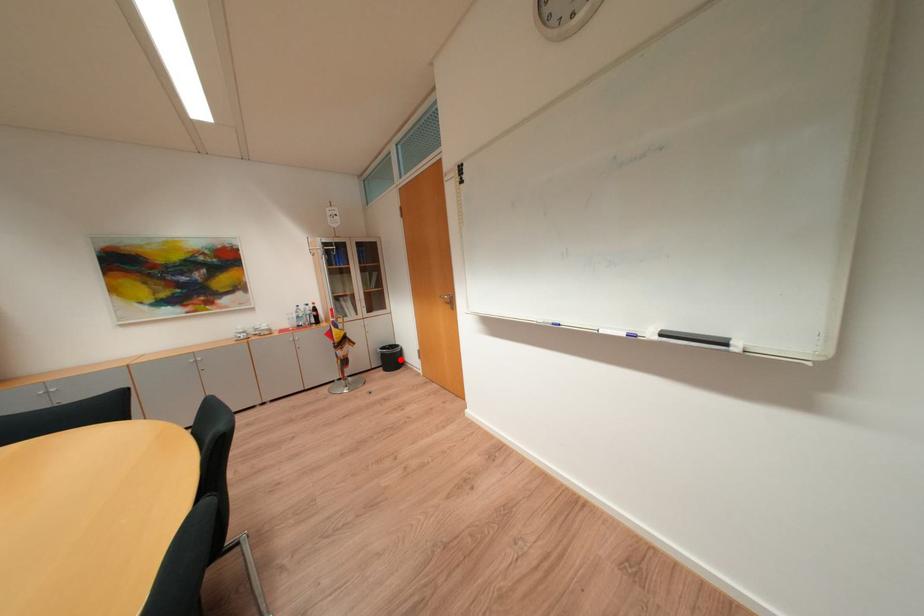
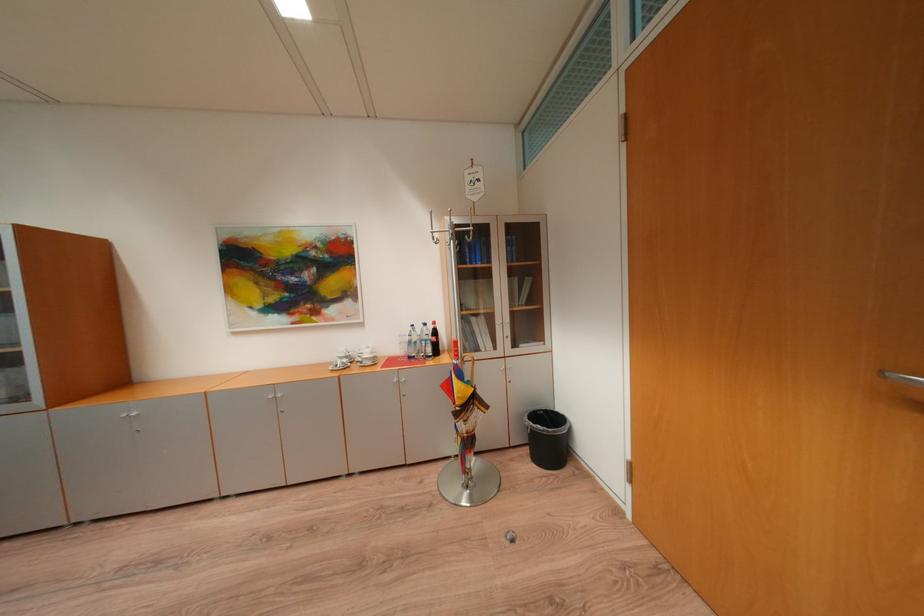
Find the pixel in the second image that matches the highlighted location in the first image.

(556, 440)